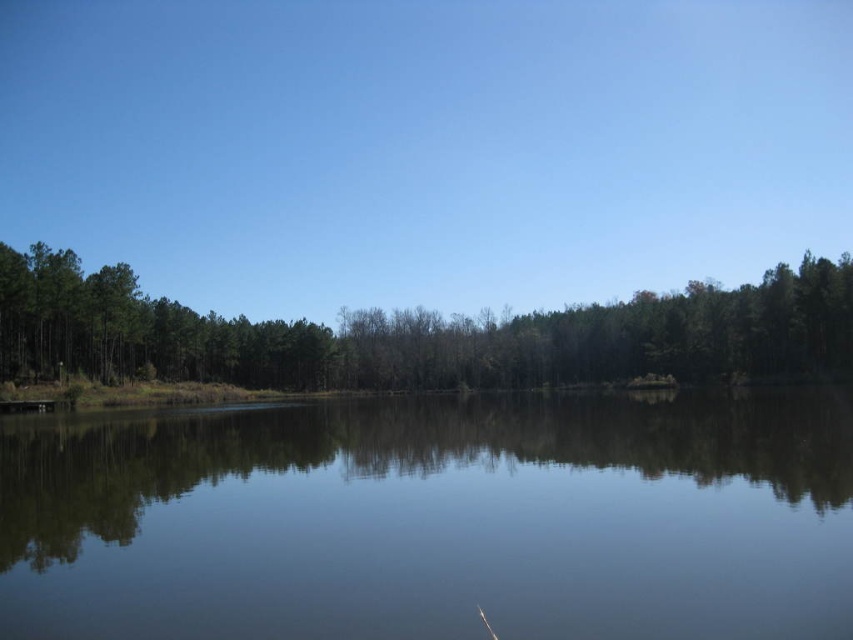
Question: Is clear water at center to the left of green matte trees at center from the viewer's perspective?

Choices:
 (A) no
 (B) yes

Answer: (B)

Question: Can you confirm if clear water at center is thinner than green matte trees at center?

Choices:
 (A) no
 (B) yes

Answer: (B)

Question: Can you confirm if clear water at center is thinner than green matte trees at center?

Choices:
 (A) yes
 (B) no

Answer: (A)